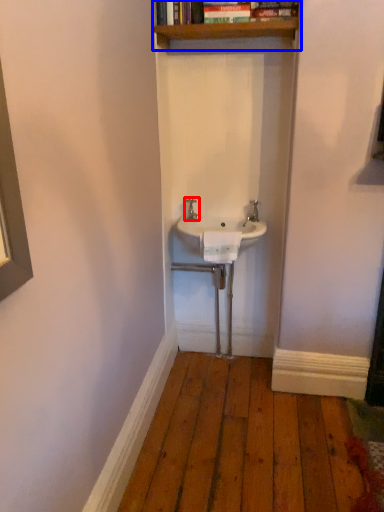
Question: Which object appears closest to the camera in this image, tap (highlighted by a red box) or shelf (highlighted by a blue box)?

Choices:
 (A) tap
 (B) shelf

Answer: (B)